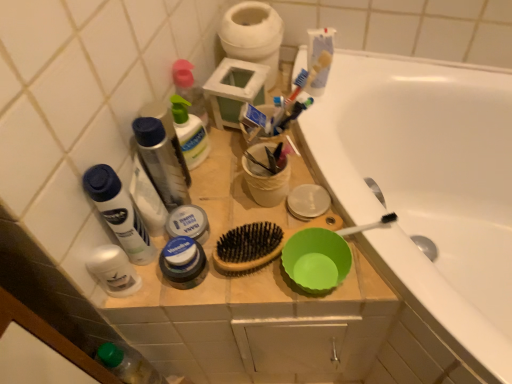
Where is `vacant area to the right of white matte tube at upper right, the second toothpaste viewed from the left`? Image resolution: width=512 pixels, height=384 pixels. vacant area to the right of white matte tube at upper right, the second toothpaste viewed from the left is located at coordinates point(384,77).